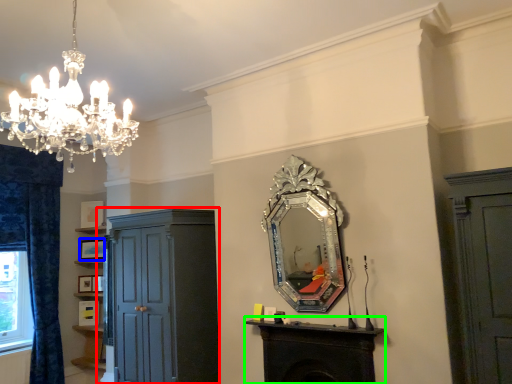
Question: Estimate the real-world distances between objects in this image. Which object is farther from cupboard (highlighted by a red box), picture frame (highlighted by a blue box) or table (highlighted by a green box)?

Choices:
 (A) picture frame
 (B) table

Answer: (A)